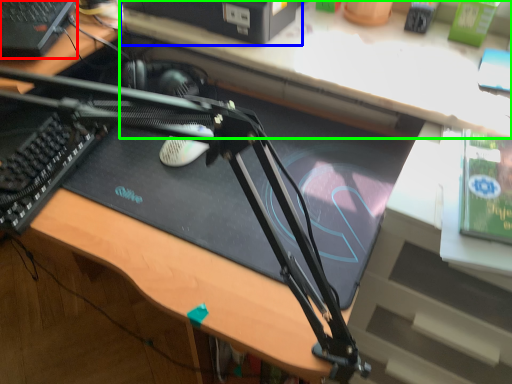
Question: Which object is positioned closest to computer (highlighted by a red box)? Select from computer (highlighted by a blue box) and computer desk (highlighted by a green box).

Choices:
 (A) computer
 (B) computer desk

Answer: (A)